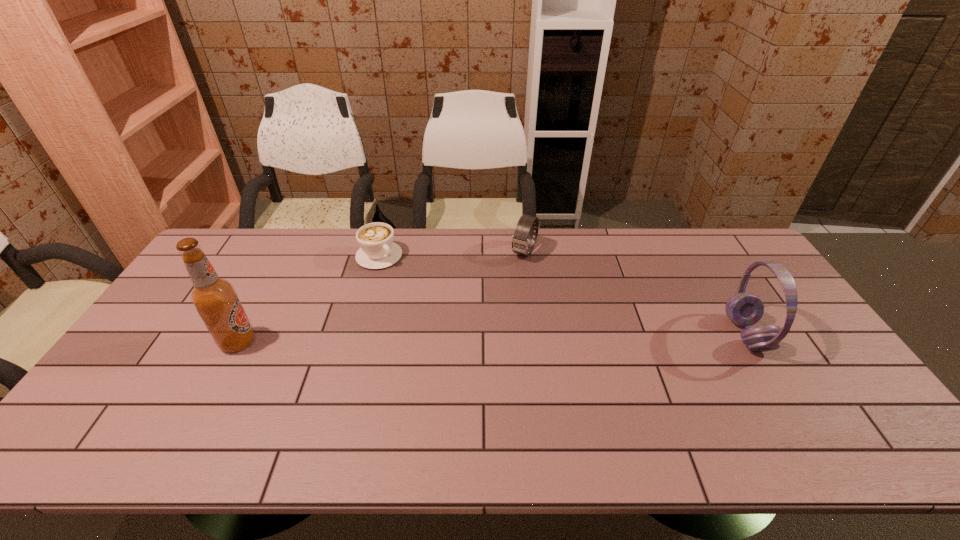
Identify the location of beer bottle. (215, 299).

The height and width of the screenshot is (540, 960). In order to click on the tallest object in this screenshot , I will do `click(215, 299)`.

What are the coordinates of `the rightmost object` in the screenshot? It's located at (744, 309).

The height and width of the screenshot is (540, 960). I want to click on headset, so pyautogui.click(x=744, y=309).

At what (x,y) coordinates should I click in order to perform the action: click on the third object from right to left. Please return your answer as a coordinate pair (x, y). Looking at the image, I should click on (378, 250).

Where is `cappuccino`? cappuccino is located at coordinates (378, 250).

This screenshot has height=540, width=960. I want to click on watch, so click(x=522, y=239).

You are a GUI agent. You are given a task and a screenshot of the screen. Output one action in this format:
    pyautogui.click(x=<x>, y=<y>)
    Task: Click on the third tallest object
    The height and width of the screenshot is (540, 960).
    Given the screenshot: What is the action you would take?
    pyautogui.click(x=522, y=239)

This screenshot has height=540, width=960. Identify the location of vacant space positioned 0.090m on the front label of the tallest object. (289, 342).

Identify the location of blank space located 0.230m on the headband and ear cups of the rightmost object. The height and width of the screenshot is (540, 960). (648, 334).